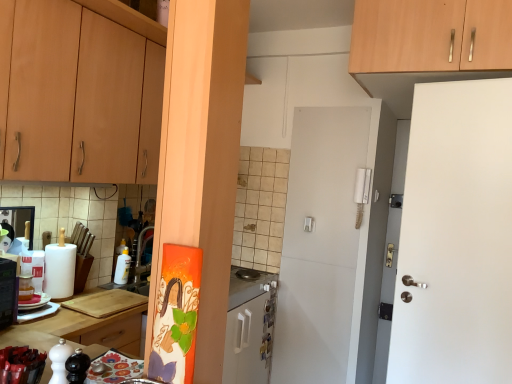
Question: Is the position of wooden cabinet at upper right, which is the 2th cabinetry from left to right, less distant than that of white plastic salt shaker at lower left?

Choices:
 (A) yes
 (B) no

Answer: (B)

Question: Is wooden cabinet at upper right, which is the 2th cabinetry from left to right, further to camera compared to white plastic salt shaker at lower left?

Choices:
 (A) no
 (B) yes

Answer: (B)

Question: Is wooden cabinet at upper right, the 1th cabinetry viewed from the right, turned away from white plastic salt shaker at lower left?

Choices:
 (A) no
 (B) yes

Answer: (A)

Question: Considering the relative sizes of wooden cabinet at upper right, which is the 2th cabinetry from left to right, and white plastic salt shaker at lower left in the image provided, is wooden cabinet at upper right, which is the 2th cabinetry from left to right, wider than white plastic salt shaker at lower left?

Choices:
 (A) no
 (B) yes

Answer: (B)

Question: Considering the relative positions of wooden cabinet at upper right, the 1th cabinetry viewed from the right, and white plastic salt shaker at lower left in the image provided, is wooden cabinet at upper right, the 1th cabinetry viewed from the right, to the right of white plastic salt shaker at lower left from the viewer's perspective?

Choices:
 (A) no
 (B) yes

Answer: (B)

Question: From a real-world perspective, is wooden cabinet at upper right, the 1th cabinetry viewed from the right, physically below white plastic salt shaker at lower left?

Choices:
 (A) no
 (B) yes

Answer: (A)

Question: Can you confirm if wooden cutting board at lower left is positioned to the left of white plastic bottle at center, which is the 1th appliance from right to left?

Choices:
 (A) yes
 (B) no

Answer: (A)

Question: Considering the relative sizes of wooden cutting board at lower left and white plastic bottle at center, which is the 1th appliance from right to left, in the image provided, is wooden cutting board at lower left taller than white plastic bottle at center, which is the 1th appliance from right to left,?

Choices:
 (A) no
 (B) yes

Answer: (B)

Question: From the image's perspective, is wooden cutting board at lower left below white plastic bottle at center, which is the 1th appliance from right to left?

Choices:
 (A) yes
 (B) no

Answer: (A)

Question: Is wooden cutting board at lower left at the right side of white plastic bottle at center, which is the 1th appliance from back to front?

Choices:
 (A) no
 (B) yes

Answer: (A)

Question: From the image's perspective, would you say wooden cutting board at lower left is positioned over white plastic bottle at center, which is the 1th appliance from back to front?

Choices:
 (A) no
 (B) yes

Answer: (A)

Question: Is wooden cutting board at lower left next to white plastic bottle at center, which appears as the second appliance when viewed from the left?

Choices:
 (A) yes
 (B) no

Answer: (B)

Question: From the image's perspective, is white plastic salt shaker at lower left located beneath wooden cutting board at lower center?

Choices:
 (A) yes
 (B) no

Answer: (B)